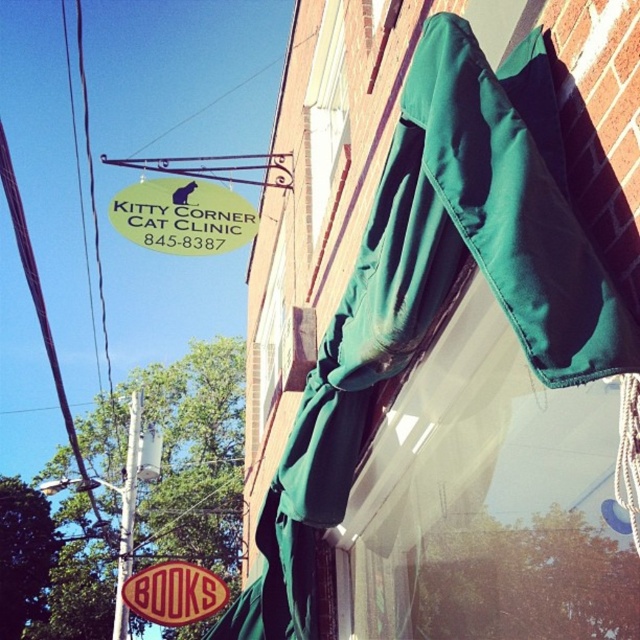
Can you confirm if green fabric awning at upper center is positioned below red plastic books at lower center?

Incorrect, green fabric awning at upper center is not positioned below red plastic books at lower center.

Can you confirm if green fabric awning at upper center is shorter than red plastic books at lower center?

In fact, green fabric awning at upper center may be taller than red plastic books at lower center.

Is point (333, 99) in front of point (221, 600)?

That is True.

Locate an element on the screen. green fabric awning at upper center is located at coordinates (324, 125).

Does green fabric awning at upper right appear under red plastic books at lower center?

No.

Does point (323, 353) lie in front of point (145, 582)?

Yes.

Does point (516, 192) come farther from viewer compared to point (220, 602)?

No, it is in front of (220, 602).

Identify the location of green fabric awning at upper right. Image resolution: width=640 pixels, height=640 pixels. (449, 328).

Measure the distance between green fabric sign at upper left and camera.

green fabric sign at upper left is 4.42 meters away from camera.

Which is in front, point (166, 177) or point (324, 68)?

Positioned in front is point (324, 68).

Describe the element at coordinates (182, 216) in the screenshot. I see `green fabric sign at upper left` at that location.

This screenshot has height=640, width=640. I want to click on green fabric sign at upper left, so click(182, 216).